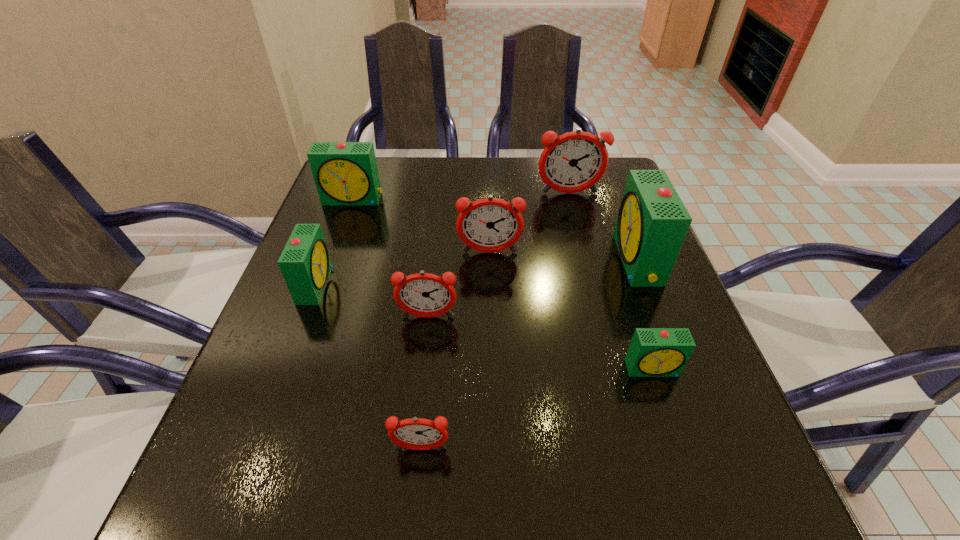
Where is `unoccupied area between the biggest green alarm clock and the rightmost reddish-pink alarm clock`? Image resolution: width=960 pixels, height=540 pixels. unoccupied area between the biggest green alarm clock and the rightmost reddish-pink alarm clock is located at coordinates (603, 227).

In order to click on empty space between the smallest reddish-pink alarm clock and the second nearest object in this screenshot , I will do `click(537, 409)`.

At what (x,y) coordinates should I click in order to perform the action: click on free spot between the third smallest reddish-pink alarm clock and the seventh farthest object. Please return your answer as a coordinate pair (x, y). The image size is (960, 540). Looking at the image, I should click on (571, 310).

The width and height of the screenshot is (960, 540). I want to click on unoccupied area between the smallest green alarm clock and the biggest reddish-pink alarm clock, so click(x=611, y=281).

Identify the location of free spot between the third biggest green alarm clock and the sixth farthest object. Image resolution: width=960 pixels, height=540 pixels. (372, 301).

What are the coordinates of `vacant space that's between the second smallest reddish-pink alarm clock and the nearest green alarm clock` in the screenshot? It's located at (540, 343).

The width and height of the screenshot is (960, 540). I want to click on vacant point located between the seventh farthest object and the nearest reddish-pink alarm clock, so click(537, 409).

This screenshot has height=540, width=960. I want to click on free space between the third biggest green alarm clock and the biggest reddish-pink alarm clock, so click(x=443, y=239).

Locate an element on the screen. This screenshot has width=960, height=540. free space between the rightmost reddish-pink alarm clock and the third smallest green alarm clock is located at coordinates (461, 197).

Image resolution: width=960 pixels, height=540 pixels. Find the location of `empty space between the third biggest green alarm clock and the nearest object`. empty space between the third biggest green alarm clock and the nearest object is located at coordinates point(369,367).